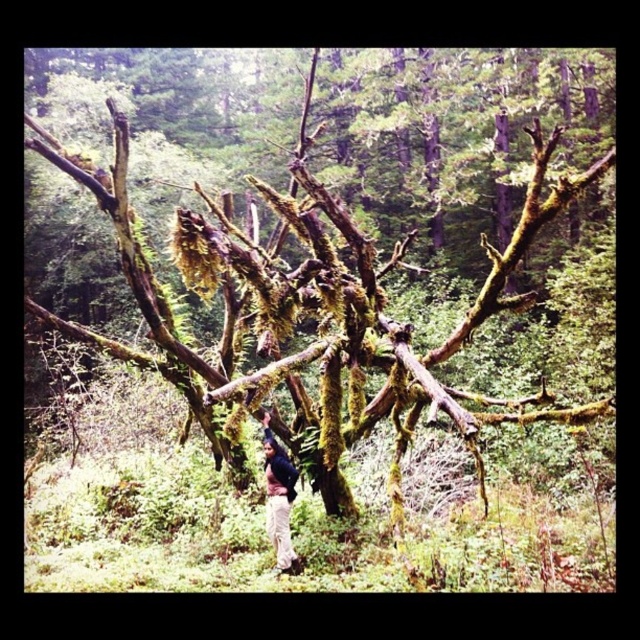
Based on the photo, is green mossy tree at center below light beige pants at lower center?

Yes.

Who is lower down, green mossy tree at center or light beige pants at lower center?

green mossy tree at center is below.

Where is `green mossy tree at center`? green mossy tree at center is located at coordinates (312, 310).